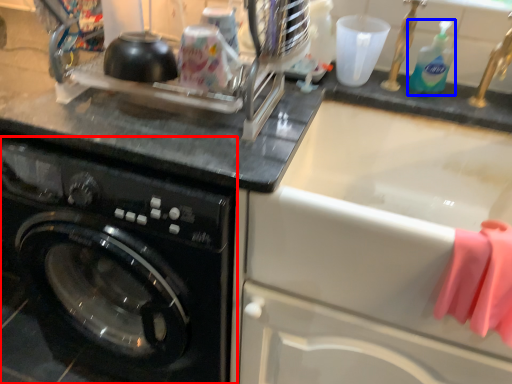
Question: Which object appears farthest to the camera in this image, washing machine (highlighted by a red box) or cleaning product (highlighted by a blue box)?

Choices:
 (A) washing machine
 (B) cleaning product

Answer: (B)